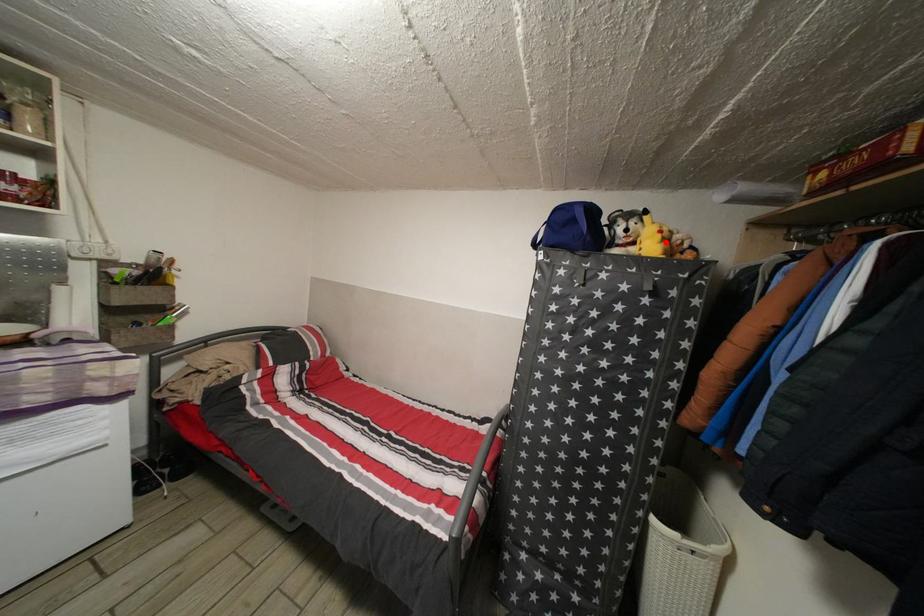
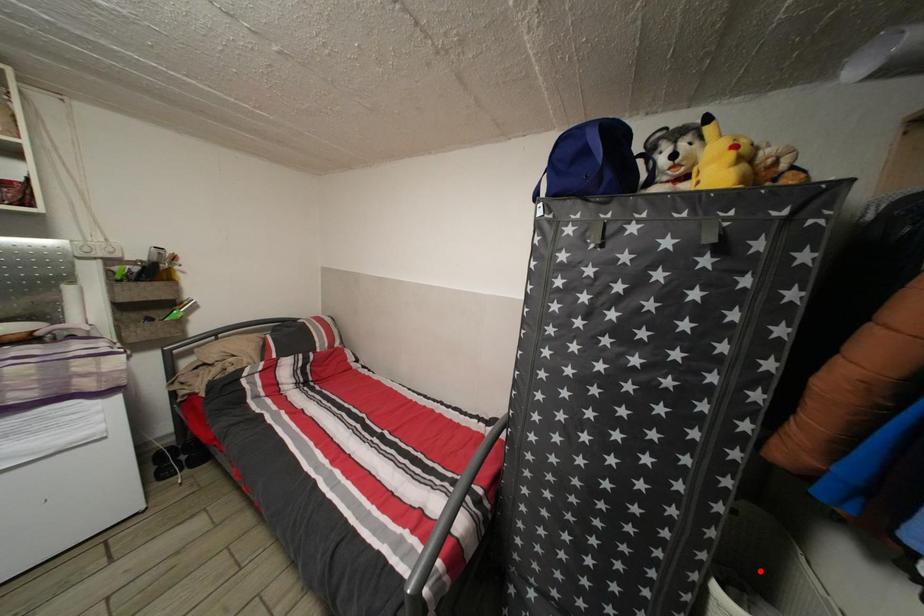
I am providing you with two images of the same scene from different viewpoints. A red point is marked on the first image and another point is marked on the second image. Do the highlighted points in image1 and image2 indicate the same real-world spot?

No